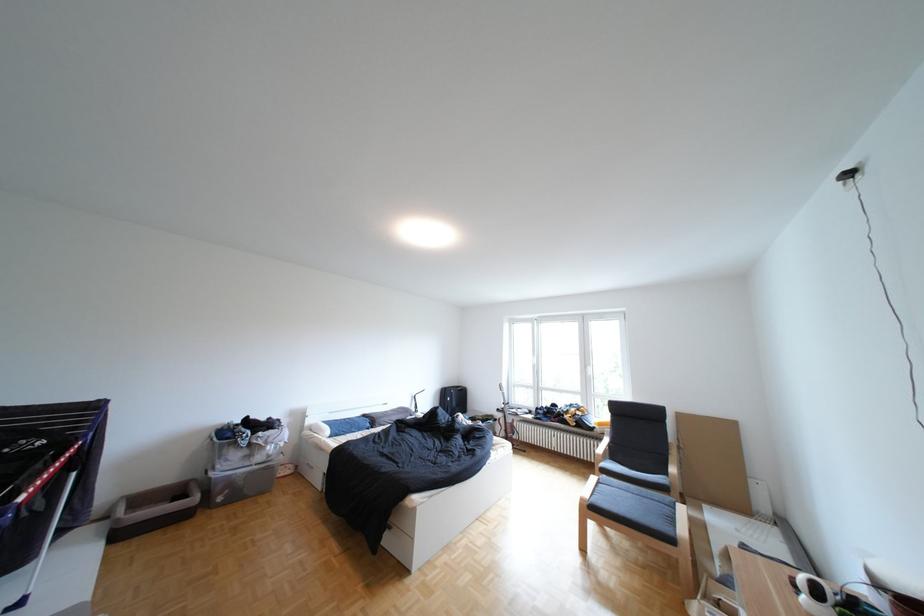
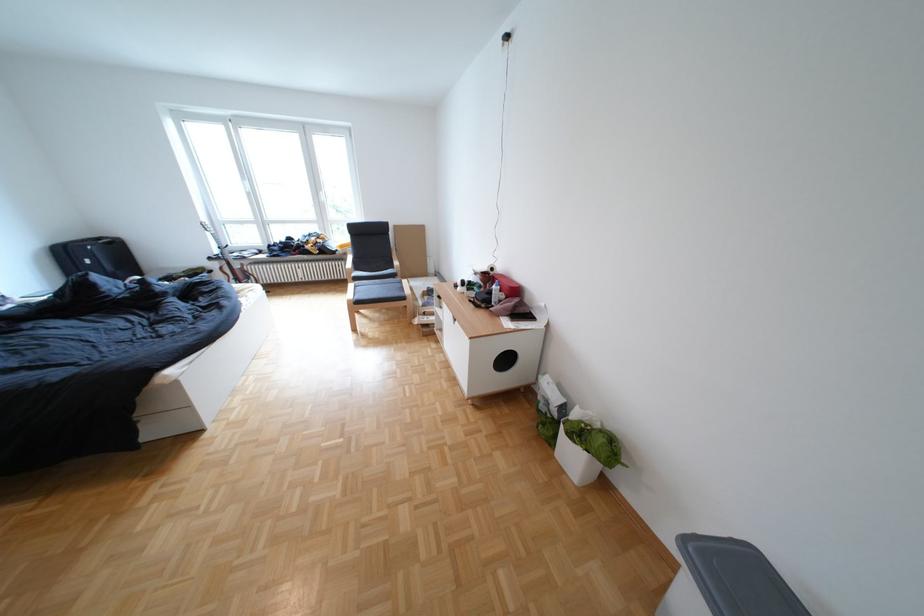
In the second image, find the point that corresponds to pixel 610 479 in the first image.

(367, 286)